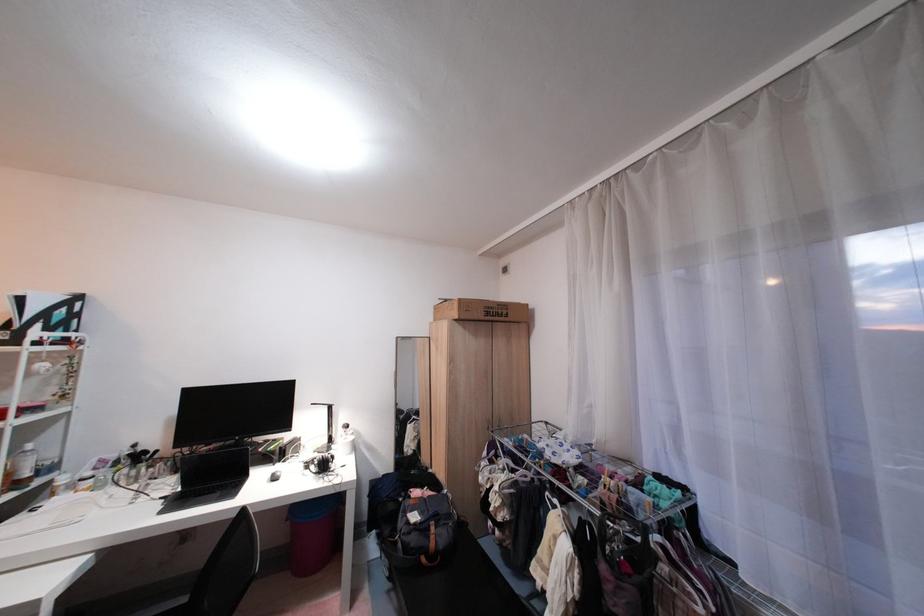
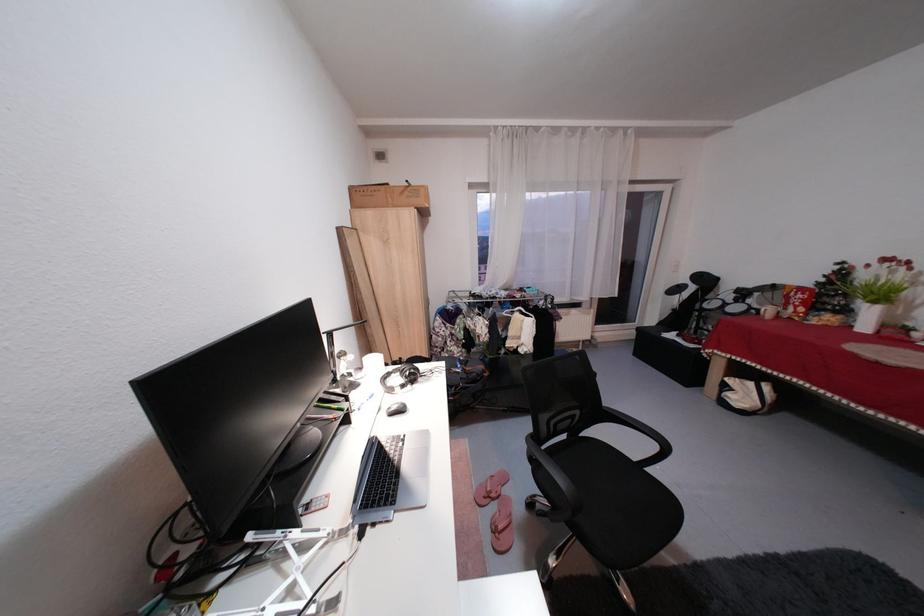
Locate, in the second image, the point that corresponds to (x=463, y=302) in the first image.

(420, 185)